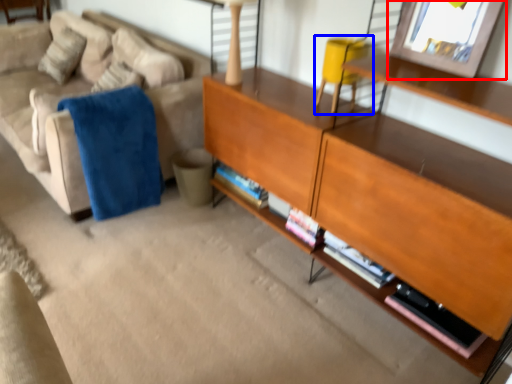
Question: Which object is closer to the camera taking this photo, picture frame (highlighted by a red box) or swivel chair (highlighted by a blue box)?

Choices:
 (A) picture frame
 (B) swivel chair

Answer: (A)